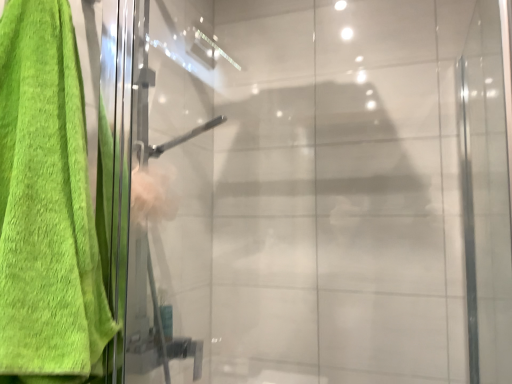
I want to click on green terry cloth towel at left, so click(x=46, y=202).

Describe the element at coordinates (46, 202) in the screenshot. I see `green terry cloth towel at left` at that location.

Identify the location of green terry cloth towel at left. (46, 202).